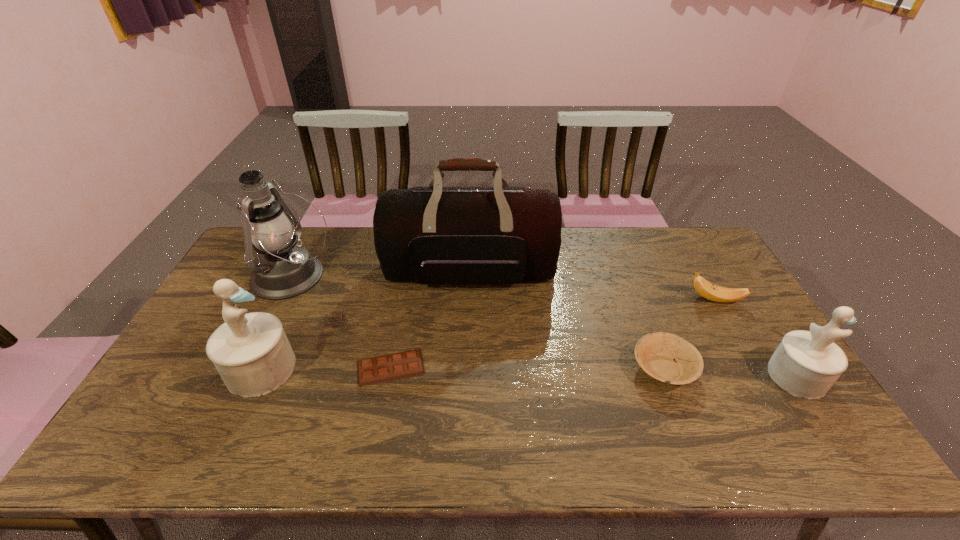
The width and height of the screenshot is (960, 540). Identify the location of oil lamp positioned at the left edge. (282, 270).

Where is `figurine that is at the right edge`? figurine that is at the right edge is located at coordinates (806, 364).

This screenshot has height=540, width=960. Find the location of `banana positioned at the right edge`. banana positioned at the right edge is located at coordinates (712, 292).

You are a GUI agent. You are given a task and a screenshot of the screen. Output one action in this format:
    pyautogui.click(x=<x>, y=<y>)
    Task: Click on the object that is at the far left corner
    Image resolution: width=960 pixels, height=540 pixels.
    Given the screenshot: What is the action you would take?
    pyautogui.click(x=282, y=270)

The width and height of the screenshot is (960, 540). In order to click on object located in the near left corner section of the desktop in this screenshot , I will do click(x=251, y=352).

Where is `object at the near right corner`? object at the near right corner is located at coordinates (806, 364).

Where is `free space at the far edge of the desktop`? free space at the far edge of the desktop is located at coordinates [x=575, y=239].

The image size is (960, 540). In the image, there is a desktop. In order to click on free space at the near edge in this screenshot , I will do `click(678, 420)`.

You are a GUI agent. You are given a task and a screenshot of the screen. Output one action in this format:
    pyautogui.click(x=<x>, y=<y>)
    Task: Click on the vacant area at the left edge
    The width and height of the screenshot is (960, 540).
    Given the screenshot: What is the action you would take?
    pyautogui.click(x=240, y=285)

Locate an element on the screen. free space at the right edge of the desktop is located at coordinates (739, 312).